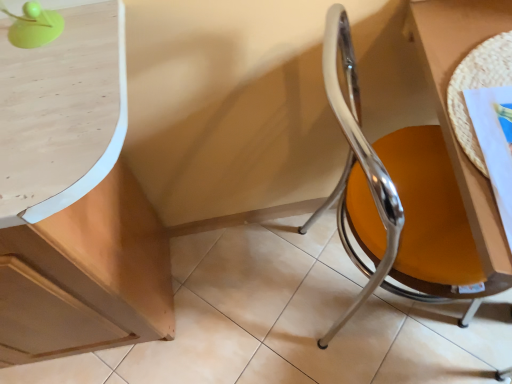
Image resolution: width=512 pixels, height=384 pixels. Find the location of `chrome/yellow seat at right`. chrome/yellow seat at right is located at coordinates (405, 200).

Which is in front, woven mat at right or light brown wood cabinet at left?

light brown wood cabinet at left is in front.

Would you say woven mat at right is a long distance from light brown wood cabinet at left?

No, there isn't a large distance between woven mat at right and light brown wood cabinet at left.

Considering the relative positions of woven mat at right and light brown wood cabinet at left in the image provided, is woven mat at right to the right of light brown wood cabinet at left from the viewer's perspective?

Indeed, woven mat at right is positioned on the right side of light brown wood cabinet at left.

Consider the image. Choose the correct answer: Is woven mat at right inside light brown wood cabinet at left or outside it?

woven mat at right is outside light brown wood cabinet at left.

This screenshot has height=384, width=512. I want to click on cabinetry that appears below the green plastic ball at upper left (from the image's perspective), so click(x=74, y=200).

Does point (59, 21) come farther from viewer compared to point (16, 91)?

Yes, it is behind point (16, 91).

Does green plastic ball at upper left turn towards light brown wood cabinet at left?

No, green plastic ball at upper left is not oriented towards light brown wood cabinet at left.

Consider the image. From the image's perspective, between green plastic ball at upper left and light brown wood cabinet at left, which one is located above?

green plastic ball at upper left.

In the scene shown: Visually, is chrome/yellow seat at right positioned to the left or to the right of woven mat at right?

From the image, it's evident that chrome/yellow seat at right is to the left of woven mat at right.

Is chrome/yellow seat at right facing away from woven mat at right?

No, chrome/yellow seat at right's orientation is not away from woven mat at right.

Is woven mat at right located within chrome/yellow seat at right?

Yes, woven mat at right is a part of chrome/yellow seat at right.

Looking at this image, considering their positions, is chrome/yellow seat at right located in front of or behind woven mat at right?

chrome/yellow seat at right is positioned closer to the viewer than woven mat at right.

Which object is further away from the camera, light brown wood cabinet at left or woven mat at right?

woven mat at right is more distant.

Is light brown wood cabinet at left wider or thinner than woven mat at right?

Clearly, light brown wood cabinet at left has more width compared to woven mat at right.

Which is farther, (x=117, y=1) or (x=437, y=83)?

Point (x=437, y=83)

Is light brown wood cabinet at left inside the boundaries of woven mat at right, or outside?

light brown wood cabinet at left exists outside the volume of woven mat at right.

Could you tell me if light brown wood cabinet at left is turned towards chrome/yellow seat at right?

No, light brown wood cabinet at left does not turn towards chrome/yellow seat at right.

Between light brown wood cabinet at left and chrome/yellow seat at right, which one has smaller width?

With smaller width is chrome/yellow seat at right.

Consider the image. Can you see light brown wood cabinet at left touching chrome/yellow seat at right?

No, light brown wood cabinet at left is not in contact with chrome/yellow seat at right.

Considering the positions of objects light brown wood cabinet at left and chrome/yellow seat at right in the image provided, who is more to the left, light brown wood cabinet at left or chrome/yellow seat at right?

light brown wood cabinet at left.

Considering the relative sizes of woven mat at right and green plastic ball at upper left in the image provided, is woven mat at right shorter than green plastic ball at upper left?

Indeed, woven mat at right has a lesser height compared to green plastic ball at upper left.

From a real-world perspective, is woven mat at right on top of green plastic ball at upper left?

No, from a real-world perspective, woven mat at right is not on top of green plastic ball at upper left.

Is woven mat at right facing away from green plastic ball at upper left?

No, woven mat at right is not facing the opposite direction of green plastic ball at upper left.

Is woven mat at right facing away from chrome/yellow seat at right?

No, woven mat at right is not facing away from chrome/yellow seat at right.

Image resolution: width=512 pixels, height=384 pixels. What are the coordinates of `chair below the woven mat at right (from a real-world perspective)` in the screenshot? It's located at (405, 200).

From the image's perspective, which is below, woven mat at right or chrome/yellow seat at right?

chrome/yellow seat at right.

Is chrome/yellow seat at right inside woven mat at right?

No, woven mat at right does not contain chrome/yellow seat at right.

Find the location of a particular element. cabinetry located on the left of woven mat at right is located at coordinates (74, 200).

Find the location of a particular element. This screenshot has height=384, width=512. table lamp located above the light brown wood cabinet at left (from a real-world perspective) is located at coordinates (34, 26).

Which object lies further to the anchor point chrome/yellow seat at right, green plastic ball at upper left or woven mat at right?

green plastic ball at upper left is further to chrome/yellow seat at right.

From the image, which object appears to be farther from chrome/yellow seat at right, light brown wood cabinet at left or woven mat at right?

The object further to chrome/yellow seat at right is light brown wood cabinet at left.

Looking at the image, which one is located closer to chrome/yellow seat at right, woven mat at right or light brown wood cabinet at left?

woven mat at right is positioned closer to the anchor chrome/yellow seat at right.

Considering their positions, is chrome/yellow seat at right positioned closer to woven mat at right than light brown wood cabinet at left?

Among the two, chrome/yellow seat at right is located nearer to woven mat at right.

Consider the image. Considering their positions, is light brown wood cabinet at left positioned further to green plastic ball at upper left than chrome/yellow seat at right?

chrome/yellow seat at right is further to green plastic ball at upper left.

Which object lies further to the anchor point chrome/yellow seat at right, woven mat at right or green plastic ball at upper left?

Among the two, green plastic ball at upper left is located further to chrome/yellow seat at right.

Considering their positions, is light brown wood cabinet at left positioned closer to green plastic ball at upper left than woven mat at right?

light brown wood cabinet at left lies closer to green plastic ball at upper left than the other object.

Based on their spatial positions, is chrome/yellow seat at right or green plastic ball at upper left closer to woven mat at right?

Among the two, chrome/yellow seat at right is located nearer to woven mat at right.

This screenshot has width=512, height=384. Identify the location of chair between green plastic ball at upper left and woven mat at right in the horizontal direction. (405, 200).

You are a GUI agent. You are given a task and a screenshot of the screen. Output one action in this format:
    pyautogui.click(x=<x>, y=<y>)
    Task: Click on the table lamp between light brown wood cabinet at left and woven mat at right
    The height and width of the screenshot is (384, 512).
    Given the screenshot: What is the action you would take?
    pyautogui.click(x=34, y=26)

I want to click on table lamp situated between light brown wood cabinet at left and chrome/yellow seat at right from left to right, so click(x=34, y=26).

Where is `chair situated between light brown wood cabinet at left and woven mat at right from left to right`? chair situated between light brown wood cabinet at left and woven mat at right from left to right is located at coordinates (405, 200).